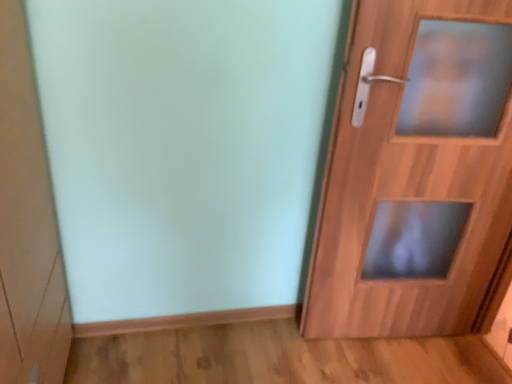
Locate an element on the screen. vacant space that's between matte white cabinet at left and wooden door at right is located at coordinates (231, 356).